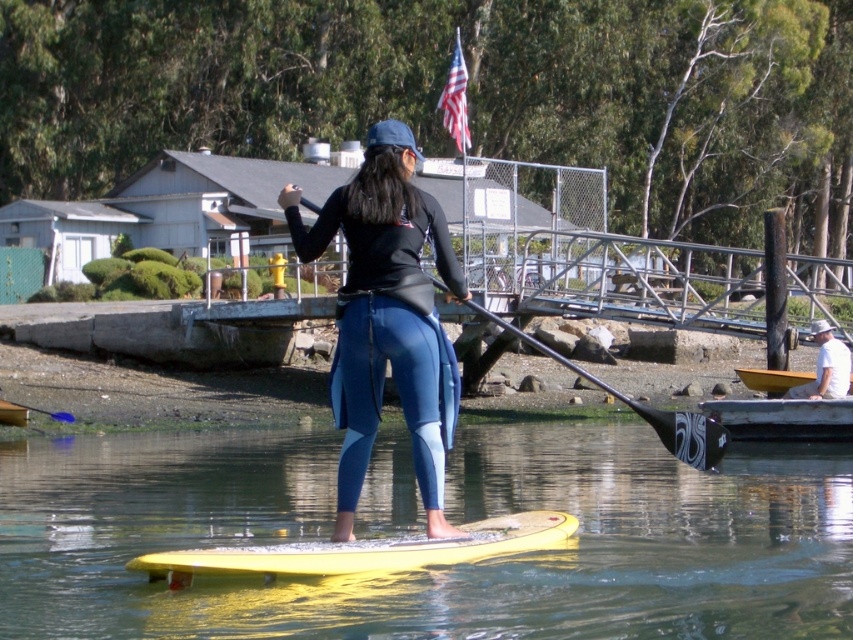
Question: Can you confirm if black glossy paddle at center is positioned to the right of wooden kayak at lower right?

Choices:
 (A) yes
 (B) no

Answer: (B)

Question: Which of these objects is positioned farthest from the yellow plastic kayak at lower left?

Choices:
 (A) black glossy paddle at center
 (B) wooden kayak at lower right

Answer: (B)

Question: Is yellow rubber paddleboard at center thinner than white cotton shirt at lower right?

Choices:
 (A) yes
 (B) no

Answer: (B)

Question: Which object is positioned closest to the blue rubber paddle at lower left?

Choices:
 (A) yellow rubber paddleboard at center
 (B) yellow rubber surfboard at center
 (C) matte black wetsuit at center
 (D) black glossy paddle at center

Answer: (A)

Question: Can you confirm if yellow rubber paddleboard at center is smaller than matte black wetsuit at center?

Choices:
 (A) yes
 (B) no

Answer: (A)

Question: Among these points, which one is nearest to the camera?

Choices:
 (A) (752, 400)
 (B) (838, 388)
 (C) (18, 406)

Answer: (B)